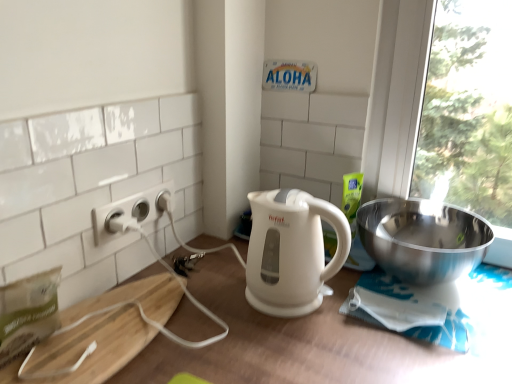
In order to click on empty space that is ontop of white matte table at center (from a real-world perspective) in this screenshot , I will do `click(333, 308)`.